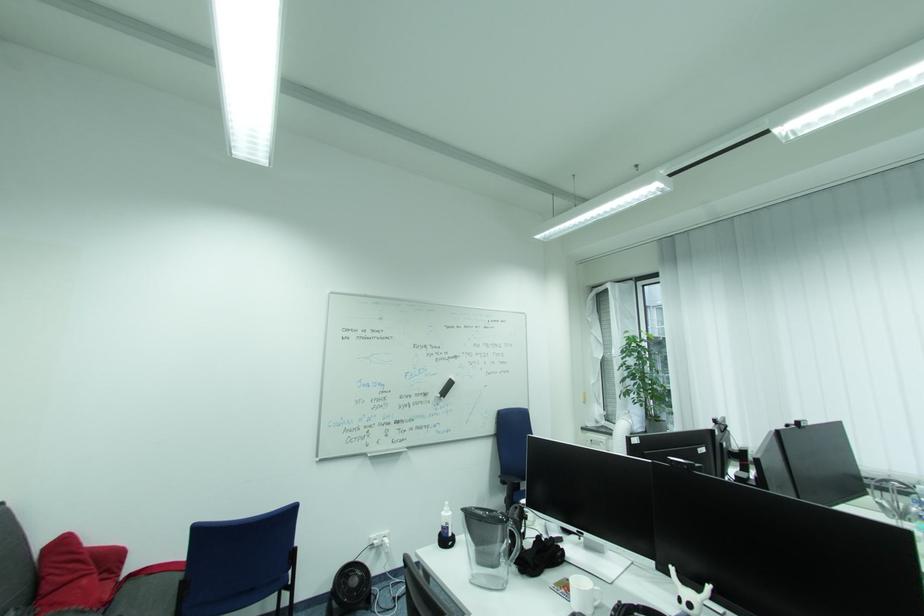
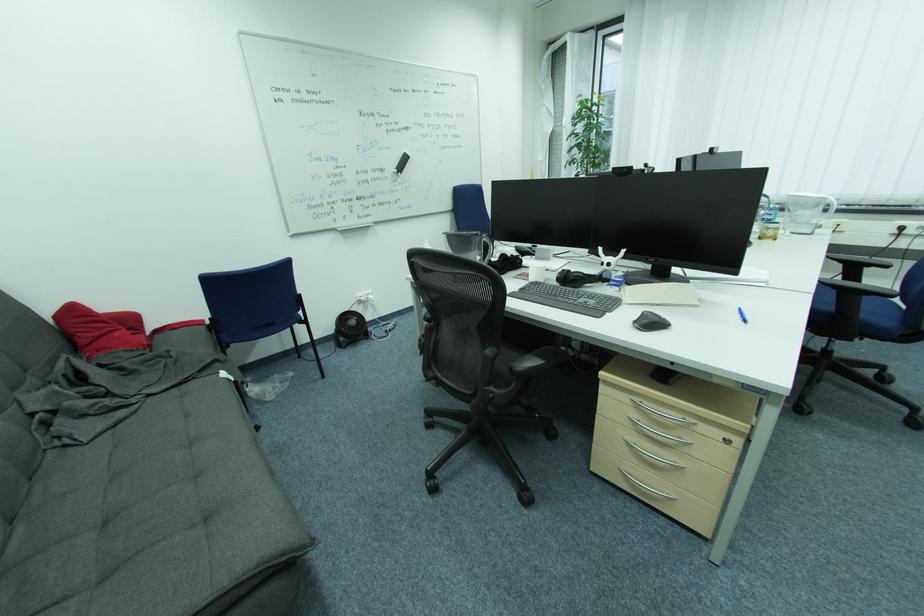
Question: How did the camera likely rotate?

Choices:
 (A) Left
 (B) Right
 (C) Up
 (D) Down

Answer: (D)